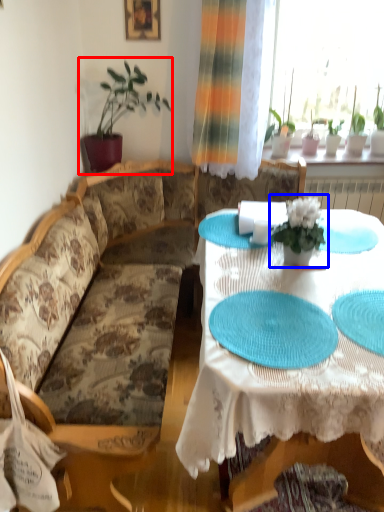
Question: Which object is closer to the camera taking this photo, houseplant (highlighted by a red box) or houseplant (highlighted by a blue box)?

Choices:
 (A) houseplant
 (B) houseplant

Answer: (B)